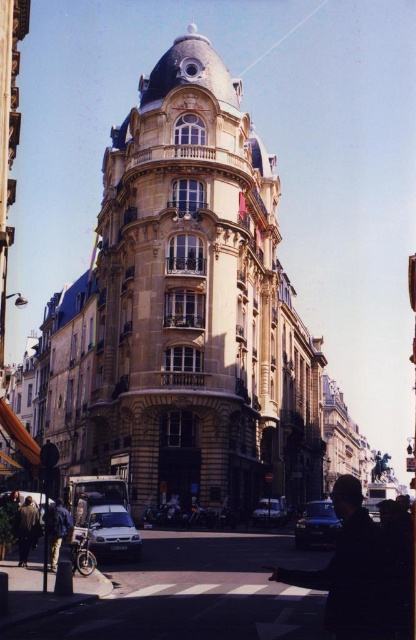
You are standing in front of the European building and see a shiny black car at center and a denim jacket at lower left. Which object is positioned more to the right side of the scene?

The shiny black car at center is positioned more to the right side of the scene compared to the denim jacket at lower left.

You are a photographer trying to capture the European building in the background. You have a shiny black car at center and a denim jacket at lower left in your frame. Which object should you move to ensure the building is fully visible?

You should move the denim jacket at lower left because the shiny black car at center is thinner and less obstructive compared to the denim jacket at lower left, which is wider.